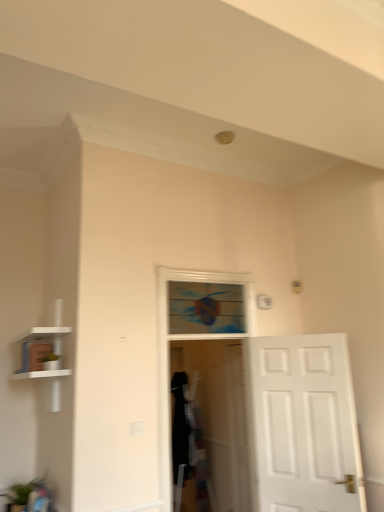
You are a GUI agent. You are given a task and a screenshot of the screen. Output one action in this format:
    pyautogui.click(x=<x>, y=<y>)
    Task: Click on the transparent plastic screen door at center
    The width and height of the screenshot is (384, 512).
    Given the screenshot: What is the action you would take?
    pyautogui.click(x=220, y=416)

Where is `white matte bookshelf at left`? The height and width of the screenshot is (512, 384). white matte bookshelf at left is located at coordinates (45, 357).

How different are the orientations of transparent plastic screen door at center and white matte door at center in degrees?

The facing directions of transparent plastic screen door at center and white matte door at center are 66.3 degrees apart.

From the image's perspective, between transparent plastic screen door at center and white matte door at center, who is located below?

From the image's view, transparent plastic screen door at center is below.

From a real-world perspective, is transparent plastic screen door at center physically located above or below white matte door at center?

transparent plastic screen door at center is below white matte door at center.

Considering the relative positions of transparent plastic screen door at center and white matte door at center in the image provided, is transparent plastic screen door at center behind white matte door at center?

Yes, it is.

Which is behind, point (56, 365) or point (273, 358)?

The point (273, 358) is farther.

Could you tell me if white matte bookshelf at left is turned towards white matte door at center?

No, white matte bookshelf at left is not turned towards white matte door at center.

Is white matte bookshelf at left positioned with its back to transparent plastic screen door at center?

Correct, white matte bookshelf at left is looking away from transparent plastic screen door at center.

Does white matte bookshelf at left have a smaller size compared to transparent plastic screen door at center?

Incorrect, white matte bookshelf at left is not smaller in size than transparent plastic screen door at center.

Locate an element on the screen. This screenshot has width=384, height=512. screen door behind the white matte bookshelf at left is located at coordinates (220, 416).

Can transparent plastic screen door at center be found inside white matte bookshelf at left?

No, transparent plastic screen door at center is located outside of white matte bookshelf at left.

Are white matte door at center and wooden stained window at center far apart?

A: No, white matte door at center is not far from wooden stained window at center.

Could you tell me if white matte door at center is facing wooden stained window at center?

No.

Which is farther, (x=283, y=396) or (x=195, y=283)?

The point (x=195, y=283) is farther.

Where is `door below the wooden stained window at center (from the image's perspective)`? Image resolution: width=384 pixels, height=512 pixels. door below the wooden stained window at center (from the image's perspective) is located at coordinates (302, 425).

Are white matte door at center and transparent plastic screen door at center far apart?

white matte door at center is positioned a significant distance from transparent plastic screen door at center.

Does point (332, 496) appear closer or farther from the camera than point (203, 378)?

Point (332, 496) is positioned closer to the camera compared to point (203, 378).

Considering the positions of objects white matte door at center and transparent plastic screen door at center in the image provided, who is more to the right, white matte door at center or transparent plastic screen door at center?

white matte door at center.

Is white matte door at center further to camera compared to transparent plastic screen door at center?

No, white matte door at center is closer to the viewer.

Does white matte door at center lie behind white matte bookshelf at left?

Yes, it is behind white matte bookshelf at left.

Which point is more distant from viewer, (x=268, y=507) or (x=35, y=338)?

The point (x=35, y=338) is farther.

Considering the sizes of objects white matte door at center and white matte bookshelf at left in the image provided, who is thinner, white matte door at center or white matte bookshelf at left?

With smaller width is white matte door at center.

Can you tell me how much white matte door at center and white matte bookshelf at left differ in facing direction?

24.4 degrees separate the facing orientations of white matte door at center and white matte bookshelf at left.

Who is smaller, wooden stained window at center or transparent plastic screen door at center?

With smaller size is wooden stained window at center.

From the image's perspective, is wooden stained window at center over transparent plastic screen door at center?

Correct, wooden stained window at center appears higher than transparent plastic screen door at center in the image.

Looking at their sizes, would you say wooden stained window at center is wider or thinner than transparent plastic screen door at center?

Clearly, wooden stained window at center has less width compared to transparent plastic screen door at center.

Where is `door located above the transparent plastic screen door at center (from a real-world perspective)`? door located above the transparent plastic screen door at center (from a real-world perspective) is located at coordinates (302, 425).

Find the location of a particular element. door that appears below the white matte bookshelf at left (from the image's perspective) is located at coordinates (302, 425).

When comparing their distances from wooden stained window at center, does white matte door at center or white matte bookshelf at left seem further?

Based on the image, white matte bookshelf at left appears to be further to wooden stained window at center.

When comparing their distances from transparent plastic screen door at center, does white matte bookshelf at left or white matte door at center seem closer?

white matte door at center is closer to transparent plastic screen door at center.

From the image, which object appears to be nearer to white matte bookshelf at left, wooden stained window at center or transparent plastic screen door at center?

wooden stained window at center is positioned closer to the anchor white matte bookshelf at left.

Consider the image. When comparing their distances from white matte door at center, does wooden stained window at center or transparent plastic screen door at center seem closer?

wooden stained window at center.

Based on their spatial positions, is transparent plastic screen door at center or wooden stained window at center further from white matte door at center?

transparent plastic screen door at center is further to white matte door at center.

From the picture: When comparing their distances from white matte bookshelf at left, does wooden stained window at center or white matte door at center seem further?

white matte door at center lies further to white matte bookshelf at left than the other object.

Based on their spatial positions, is white matte door at center or transparent plastic screen door at center closer to white matte bookshelf at left?

white matte door at center is closer to white matte bookshelf at left.

Considering their positions, is white matte bookshelf at left positioned closer to white matte door at center than wooden stained window at center?

Based on the image, wooden stained window at center appears to be nearer to white matte door at center.

This screenshot has height=512, width=384. What are the coordinates of `door that lies between wooden stained window at center and transparent plastic screen door at center from top to bottom` in the screenshot? It's located at (302, 425).

At what (x,y) coordinates should I click in order to perform the action: click on screen door between white matte bookshelf at left and white matte door at center. Please return your answer as a coordinate pair (x, y). The image size is (384, 512). Looking at the image, I should click on (220, 416).

Identify the location of window situated between white matte bookshelf at left and white matte door at center from left to right. This screenshot has height=512, width=384. (205, 308).

Identify the location of window between white matte bookshelf at left and transparent plastic screen door at center. This screenshot has height=512, width=384. (205, 308).